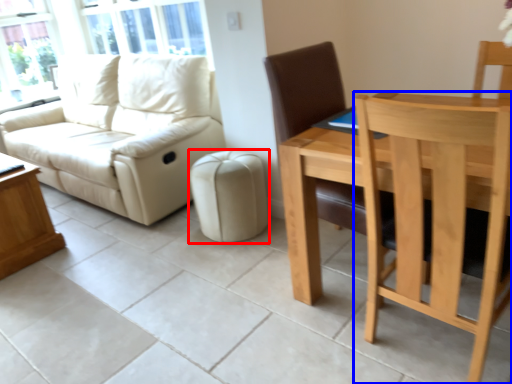
Question: Among these objects, which one is farthest to the camera, stool (highlighted by a red box) or chair (highlighted by a blue box)?

Choices:
 (A) stool
 (B) chair

Answer: (A)